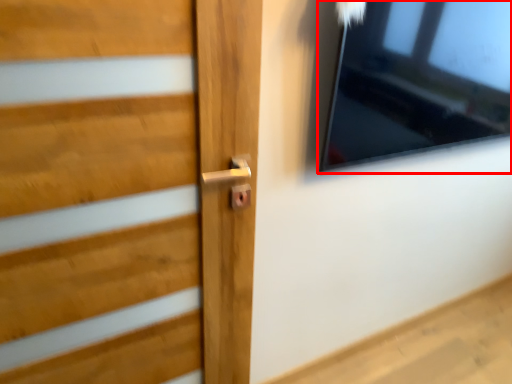
Question: From the image's perspective, considering the relative positions of window (annotated by the red box) and door in the image provided, where is window (annotated by the red box) located with respect to the staircase?

Choices:
 (A) below
 (B) above

Answer: (B)